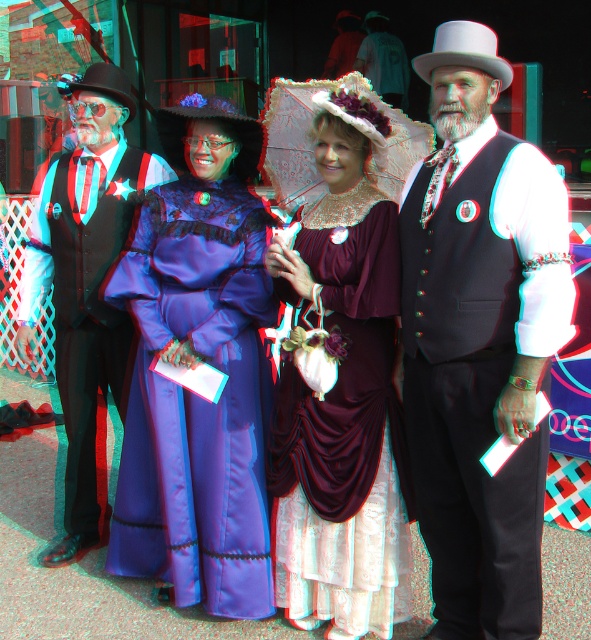
Question: Is maroon satin dress at center positioned before brushed metal vest at left?

Choices:
 (A) no
 (B) yes

Answer: (B)

Question: Which point is farther to the camera?

Choices:
 (A) (339, 253)
 (B) (70, 467)
 (C) (488, 44)
 (D) (258, 470)

Answer: (B)

Question: Is matte black vest at center thinner than maroon satin dress at center?

Choices:
 (A) no
 (B) yes

Answer: (B)

Question: Which of the following is the closest to the observer?

Choices:
 (A) (176, 124)
 (B) (290, 365)

Answer: (B)

Question: Among these objects, which one is nearest to the camera?

Choices:
 (A) matte black vest at center
 (B) brushed metal vest at left
 (C) satin purple dress at center

Answer: (A)

Question: Can you confirm if matte black vest at center is smaller than brushed metal vest at left?

Choices:
 (A) no
 (B) yes

Answer: (B)